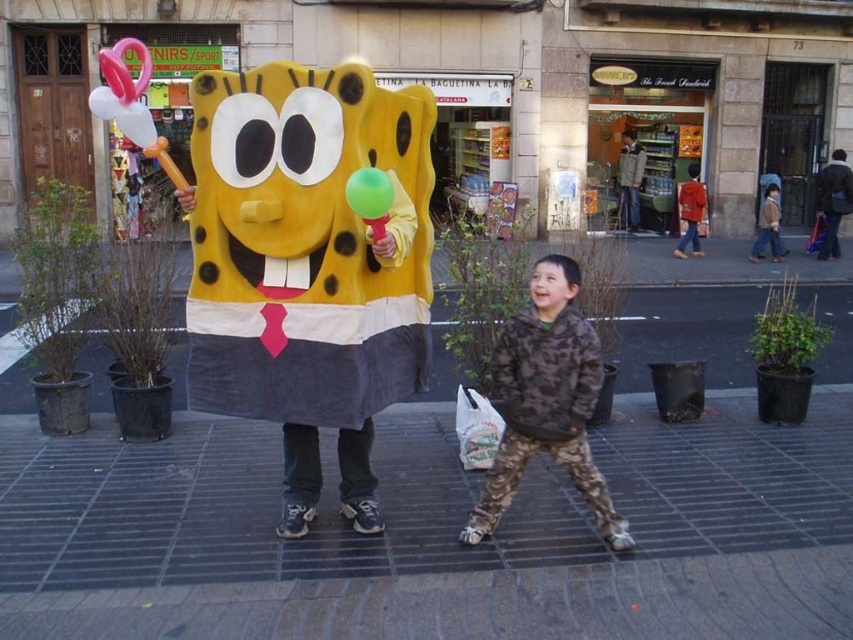
Question: Which point is closer to the camera taking this photo?

Choices:
 (A) (538, 337)
 (B) (367, 193)
 (C) (260, 236)

Answer: (B)

Question: Is matte yellow sponge at center thinner than camouflage jacket at center?

Choices:
 (A) no
 (B) yes

Answer: (A)

Question: Which of the following is the closest to the observer?

Choices:
 (A) (521, 321)
 (B) (201, 140)
 (C) (373, 179)

Answer: (C)

Question: Does matte yellow sponge at center lie behind green rubber balloon at center?

Choices:
 (A) no
 (B) yes

Answer: (B)

Question: Among these objects, which one is farthest from the camera?

Choices:
 (A) camouflage jacket at center
 (B) green rubber balloon at center

Answer: (A)

Question: Observing the image, what is the correct spatial positioning of camouflage jacket at center in reference to green rubber balloon at center?

Choices:
 (A) right
 (B) left

Answer: (A)